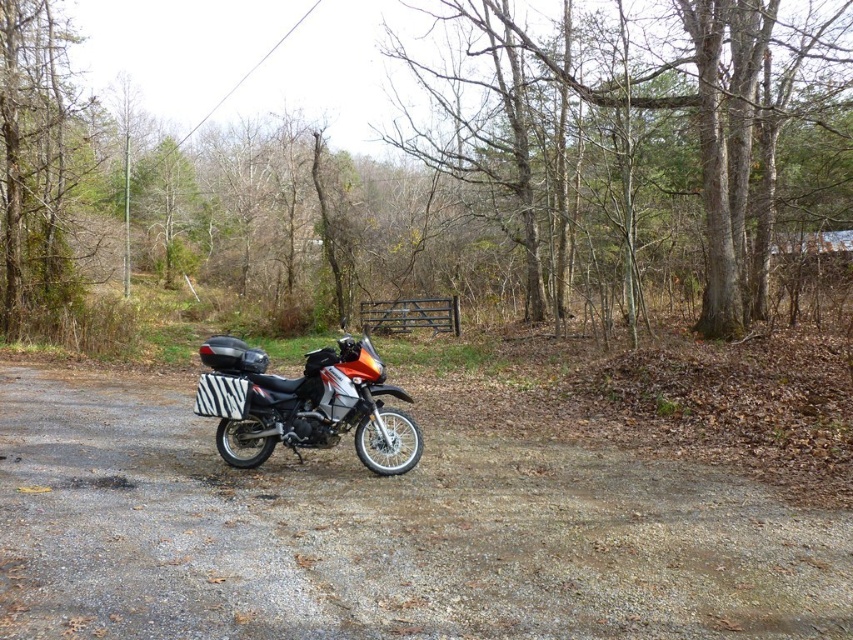
Question: Among these points, which one is farthest from the camera?

Choices:
 (A) (421, 300)
 (B) (505, 67)
 (C) (57, 177)
 (D) (3, 492)

Answer: (B)

Question: Does zebra-patterned hard case at center lie behind brown wooden gate at center?

Choices:
 (A) no
 (B) yes

Answer: (A)

Question: Which of the following is the closest to the observer?

Choices:
 (A) click(374, 310)
 (B) click(144, 442)
 (C) click(759, 51)
 (D) click(320, 403)

Answer: (D)

Question: Can you confirm if green leafy tree at left is bigger than zebra-patterned hard case at center?

Choices:
 (A) yes
 (B) no

Answer: (A)

Question: Is the position of green leafy tree at left more distant than that of zebra-patterned hard case at center?

Choices:
 (A) yes
 (B) no

Answer: (A)

Question: Which point appears farthest from the camera in this image?

Choices:
 (A) (662, 93)
 (B) (387, 449)
 (C) (85, 145)
 (D) (403, 332)

Answer: (C)